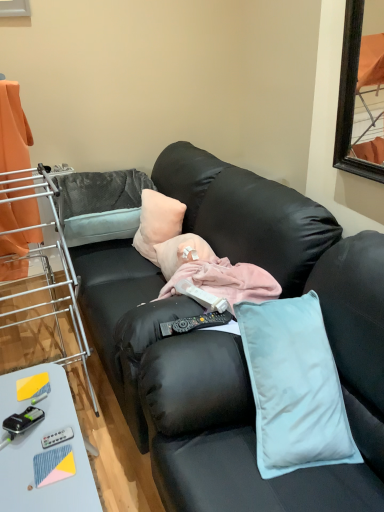
Question: From the image's perspective, is peachy soft pillow at center above or below orange fabric curtain at left?

Choices:
 (A) above
 (B) below

Answer: (B)

Question: Considering the positions of peachy soft pillow at center and orange fabric curtain at left in the image, is peachy soft pillow at center wider or thinner than orange fabric curtain at left?

Choices:
 (A) wide
 (B) thin

Answer: (B)

Question: Estimate the real-world distances between objects in this image. Which object is farther from the black plastic remote control at center?

Choices:
 (A) black leather couch at center
 (B) orange fabric curtain at left
 (C) light blue plastic table at lower left
 (D) peachy soft pillow at center
 (E) black plastic remote control at lower left, which ranks as the second equipment in right-to-left order

Answer: (D)

Question: Estimate the real-world distances between objects in this image. Which object is closer to the black plastic remote control at lower left, which ranks as the second equipment in right-to-left order?

Choices:
 (A) metal/brushed metal laundry rack at left
 (B) black plastic remote control at center
 (C) metallic silver remote control at lower left, the first equipment viewed from the right
 (D) peachy soft pillow at center
 (E) black leather couch at center

Answer: (C)